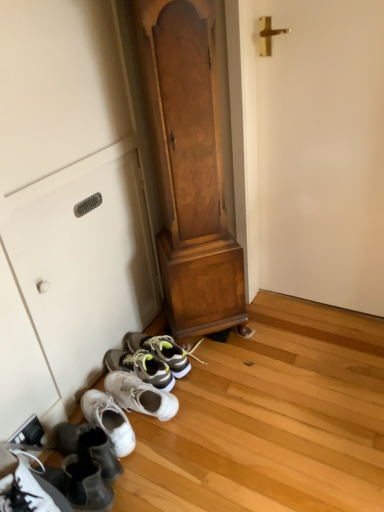
Question: Considering the positions of white suede shoes at lower left and white matte door at right in the image, is white suede shoes at lower left wider or thinner than white matte door at right?

Choices:
 (A) thin
 (B) wide

Answer: (B)

Question: From their relative heights in the image, would you say white suede shoes at lower left is taller or shorter than white matte door at right?

Choices:
 (A) short
 (B) tall

Answer: (A)

Question: Which is nearer to the white matte door at right?

Choices:
 (A) white suede shoes at lower left
 (B) white matte cabinet at lower left
 (C) wooden dresser at center

Answer: (C)

Question: Which object is positioned closest to the white matte cabinet at lower left?

Choices:
 (A) wooden dresser at center
 (B) white suede shoes at lower left
 (C) white matte door at right

Answer: (A)